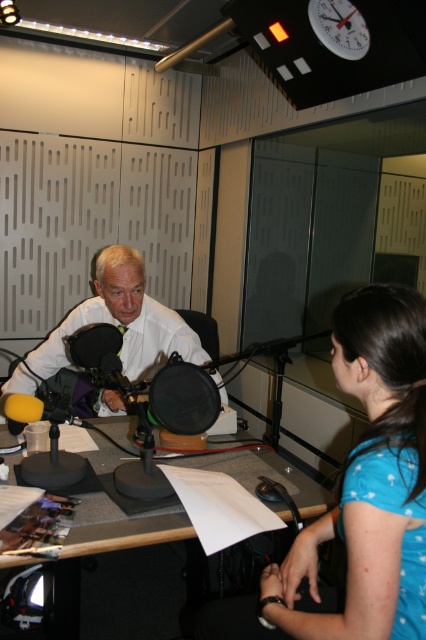
Based on the scene description, which object is wider when comparing the white glossy shirt at center and the gray matte desk at center?

The white glossy shirt at center is wider than the gray matte desk at center according to the description.

In the radio studio scene, there is a white glossy shirt at center and a white plastic clock at upper center. From the perspective of someone facing the scene, which object is positioned to the left of the other?

The white glossy shirt at center is to the left of the white plastic clock at upper center.

You are a guest entering the radio studio and see the white glossy shirt at center and the white plastic clock at upper center. Which object is closer to you from your perspective?

The white glossy shirt at center is closer to you because it is in front of the white plastic clock at upper center.